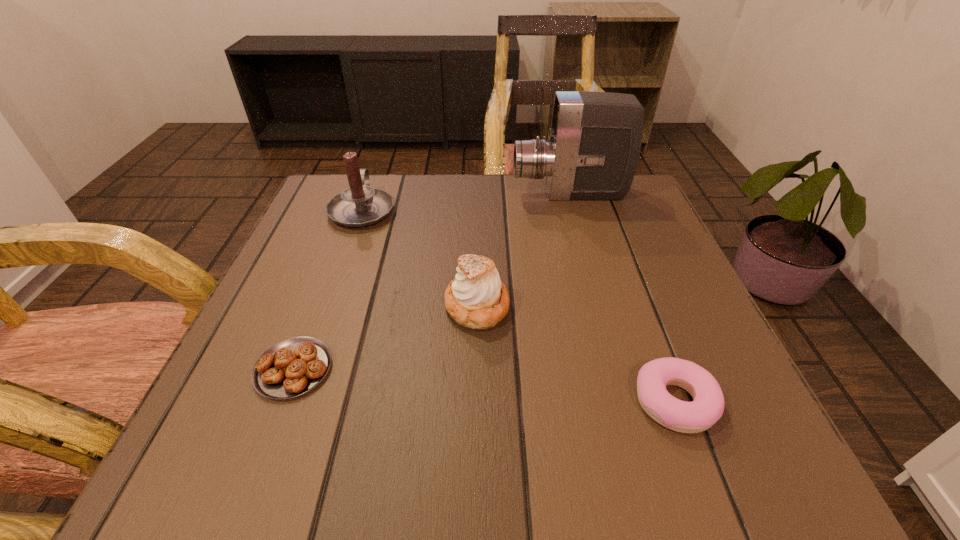
At what (x,y) coordinates should I click in order to perform the action: click on free point between the camcorder and the shortest object. Please return your answer as a coordinate pair (x, y). This screenshot has height=540, width=960. Looking at the image, I should click on (431, 281).

Image resolution: width=960 pixels, height=540 pixels. What are the coordinates of `vacant area that lies between the shortest pastry and the camcorder` in the screenshot? It's located at (431, 281).

In order to click on empty space that is in between the camcorder and the shortest pastry in this screenshot , I will do `click(431, 281)`.

Find the location of `free space between the tallest pastry and the fourth shortest object`. free space between the tallest pastry and the fourth shortest object is located at coordinates (420, 258).

Identify which object is located as the nearest to the tallest object. Please provide its 2D coordinates. Your answer should be formatted as a tuple, i.e. [(x, y)], where the tuple contains the x and y coordinates of a point satisfying the conditions above.

[(477, 299)]

This screenshot has width=960, height=540. Find the location of `object that is the third closest to the second shortest object`. object that is the third closest to the second shortest object is located at coordinates (594, 143).

This screenshot has height=540, width=960. I want to click on pastry object that ranks as the closest to the camcorder, so click(x=477, y=299).

Identify which pastry is the second nearest to the third object from right to left. Please provide its 2D coordinates. Your answer should be formatted as a tuple, i.e. [(x, y)], where the tuple contains the x and y coordinates of a point satisfying the conditions above.

[(699, 415)]

Where is `vacant space that satisfies the following two spatial constraints: 1. at the front of the camcorder, highlighting the lens; 2. on the front side of the third tallest object`? vacant space that satisfies the following two spatial constraints: 1. at the front of the camcorder, highlighting the lens; 2. on the front side of the third tallest object is located at coordinates (601, 307).

I want to click on free space that satisfies the following two spatial constraints: 1. at the front of the tallest object, highlighting the lens; 2. on the left side of the fourth tallest object, so click(x=629, y=402).